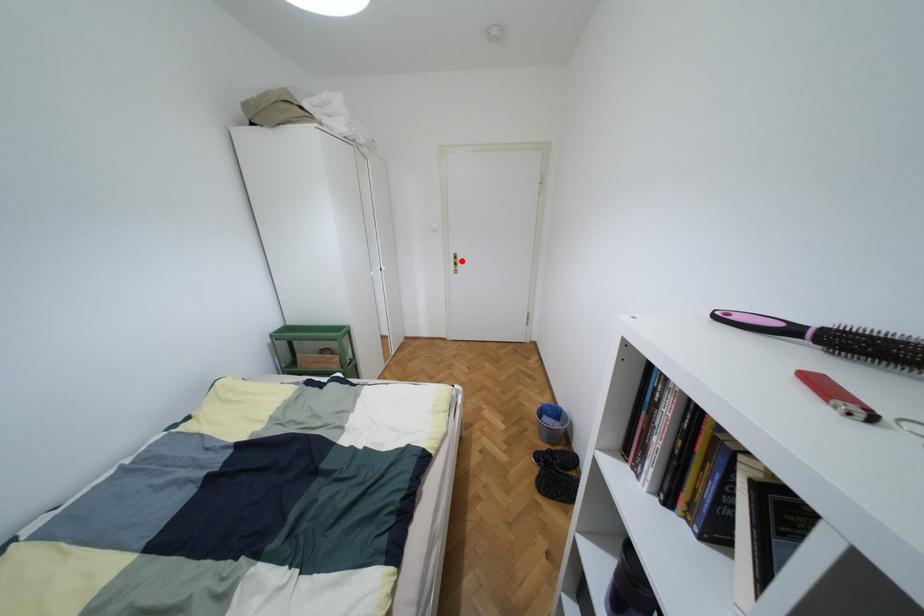
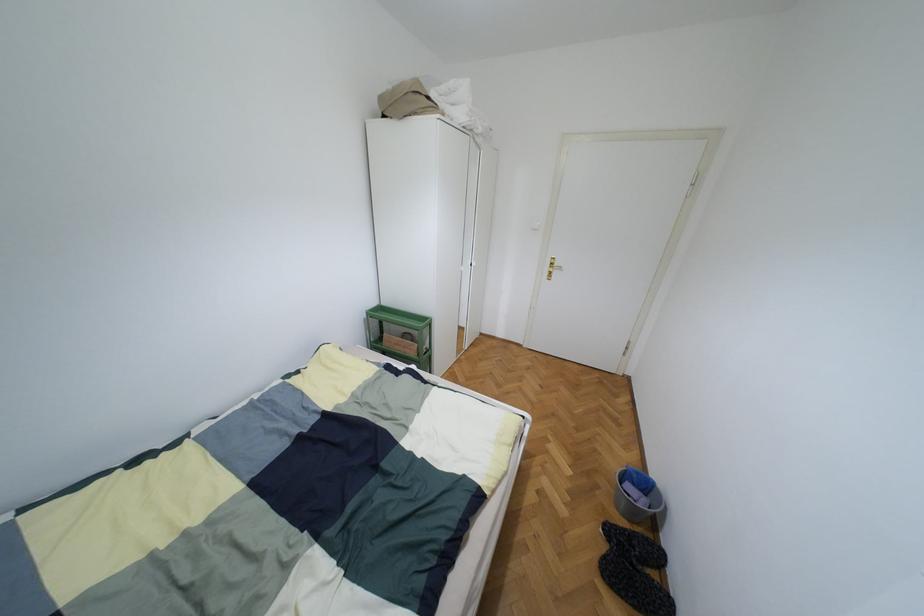
Locate, in the second image, the point that corresponds to the highlighted location in the first image.

(560, 267)